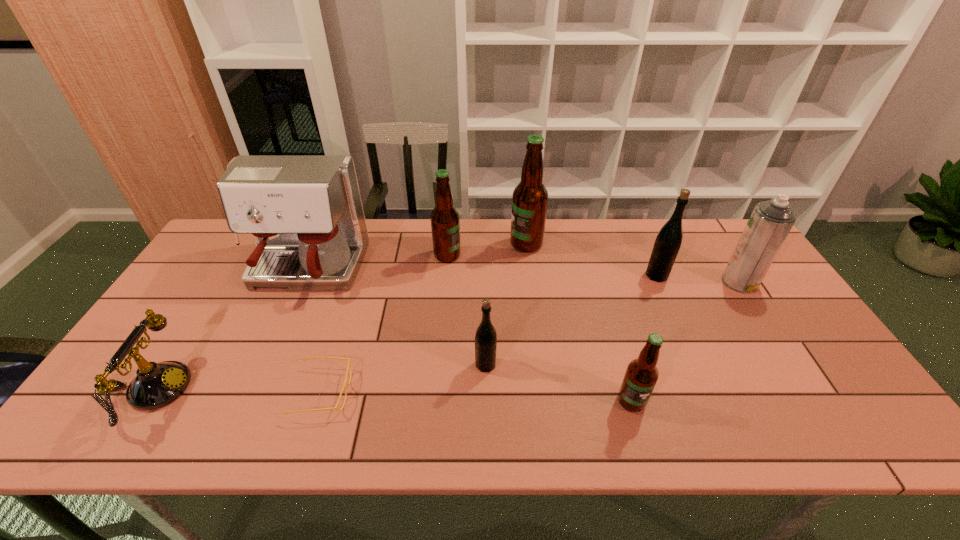
At what (x,y) coordinates should I click in order to perform the action: click on the second beer bottle from left to right. Please return your answer as a coordinate pair (x, y). This screenshot has width=960, height=540. Looking at the image, I should click on (486, 336).

Find the location of `the second nearest beer bottle`. the second nearest beer bottle is located at coordinates (486, 336).

Where is `telephone`? This screenshot has height=540, width=960. telephone is located at coordinates (156, 385).

This screenshot has height=540, width=960. Find the location of `the eighth tallest object`. the eighth tallest object is located at coordinates (156, 385).

Find the location of a particular element. The width and height of the screenshot is (960, 540). the shortest object is located at coordinates (345, 382).

I want to click on beige spectacles, so click(345, 382).

This screenshot has height=540, width=960. Identify the location of free space located on the label of the tallest beer bottle. (474, 244).

Identify the location of free space located on the label of the tallest beer bottle. (417, 244).

I want to click on blank space located 0.100m on the label of the tallest beer bottle, so click(480, 244).

Where is `vacant space located 0.060m on the front of the red coffee maker near the spout`? vacant space located 0.060m on the front of the red coffee maker near the spout is located at coordinates (281, 323).